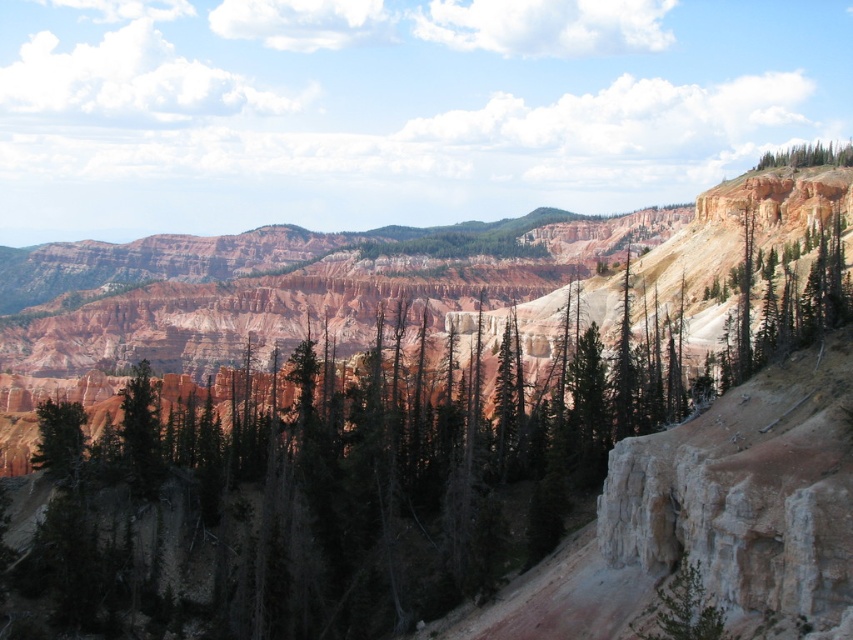
You are a hiker planning to set up a campsite between the green matte tree at center and the green textured tree at upper right. Considering their sizes, which tree would provide more shade coverage for your tent?

The green matte tree at center has a larger width than the green textured tree at upper right, so it would provide more shade coverage for your tent.

You are a hiker standing at the point marked by the coordinates (328, 486). Based on the scene described, which object are you currently positioned on?

The point at coordinates (328, 486) is located on the green matte tree at center, so you are positioned on the green matte tree at center.